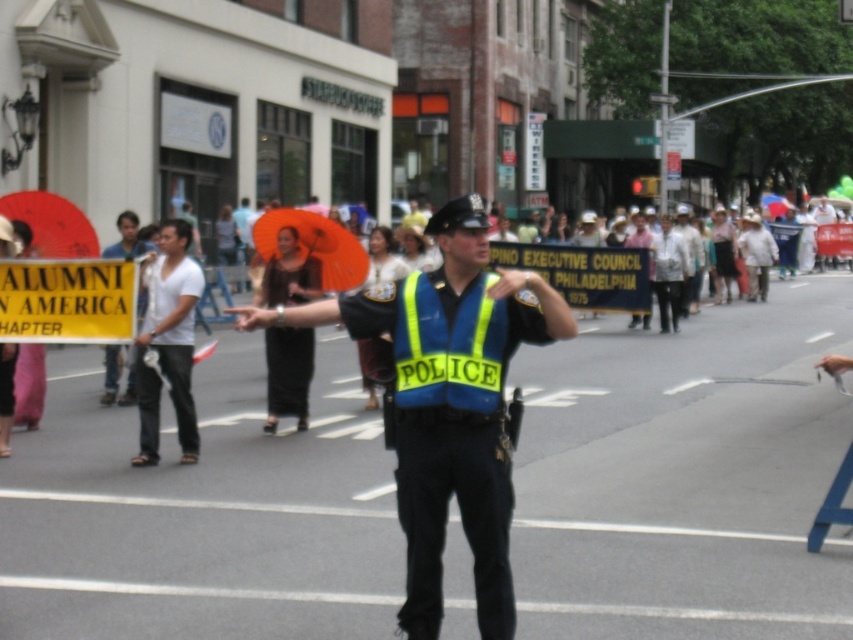
Does blue reflective vest at center appear on the right side of yellow reflective fabric police vest at center?

No, blue reflective vest at center is not to the right of yellow reflective fabric police vest at center.

Can you confirm if blue reflective vest at center is shorter than yellow reflective fabric police vest at center?

In fact, blue reflective vest at center may be taller than yellow reflective fabric police vest at center.

Is point (473, 573) closer to viewer compared to point (416, 364)?

That is False.

You are a GUI agent. You are given a task and a screenshot of the screen. Output one action in this format:
    pyautogui.click(x=<x>, y=<y>)
    Task: Click on the blue reflective vest at center
    This screenshot has width=853, height=640.
    Given the screenshot: What is the action you would take?
    pyautogui.click(x=448, y=403)

Does yellow reflective fabric police vest at center have a greater width compared to white cotton shirt at left?

Yes, yellow reflective fabric police vest at center is wider than white cotton shirt at left.

Between yellow reflective fabric police vest at center and white cotton shirt at left, which one appears on the left side from the viewer's perspective?

Positioned to the left is white cotton shirt at left.

Does point (393, 394) come in front of point (131, 212)?

Yes, it is in front of point (131, 212).

Identify the location of yellow reflective fabric police vest at center. (450, 346).

Is point (555, 336) closer to viewer compared to point (132, 352)?

Yes, it is.

Does blue reflective vest at center have a smaller size compared to white cotton shirt at left?

Incorrect, blue reflective vest at center is not smaller in size than white cotton shirt at left.

Where is `blue reflective vest at center`? blue reflective vest at center is located at coordinates (448, 403).